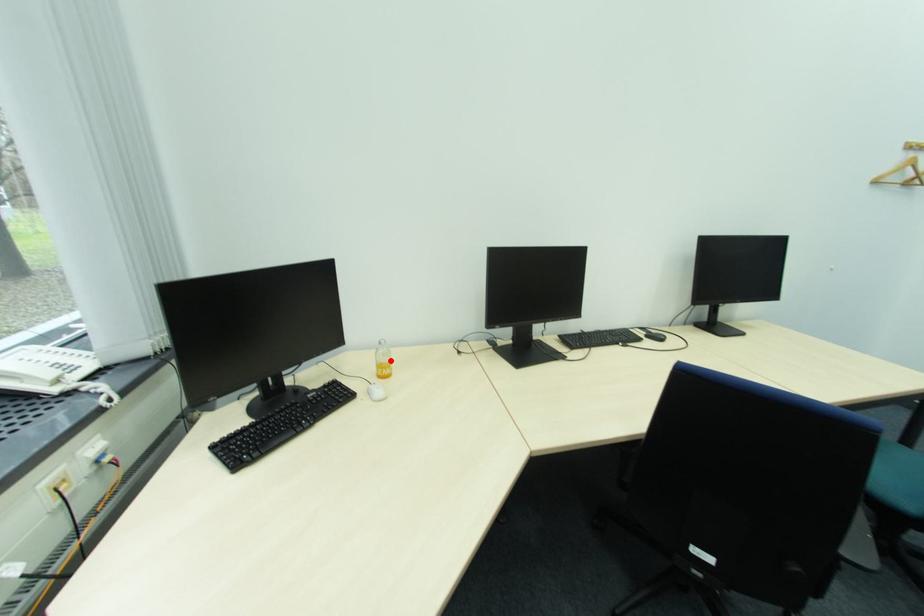
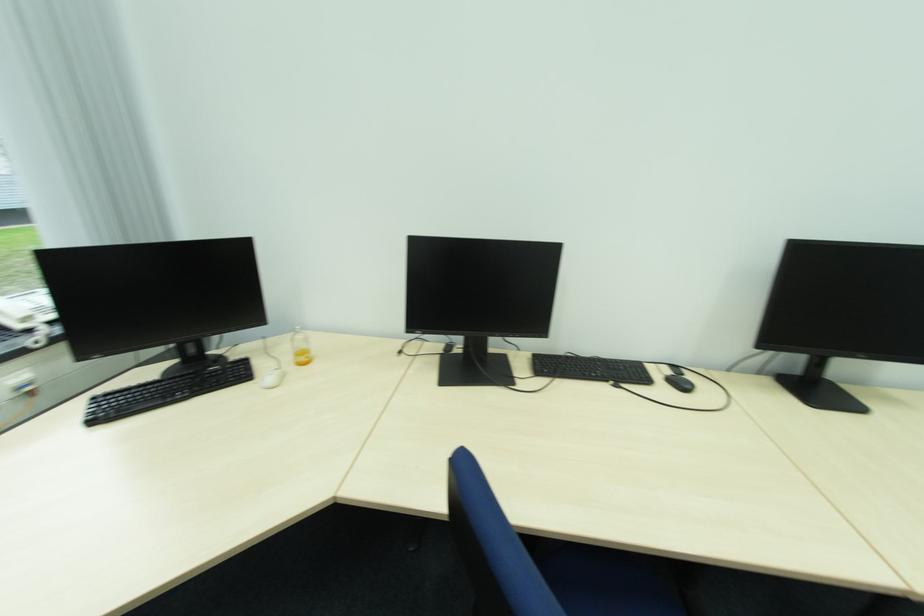
Locate, in the second image, the point that corresponds to the highlighted location in the first image.

(310, 347)